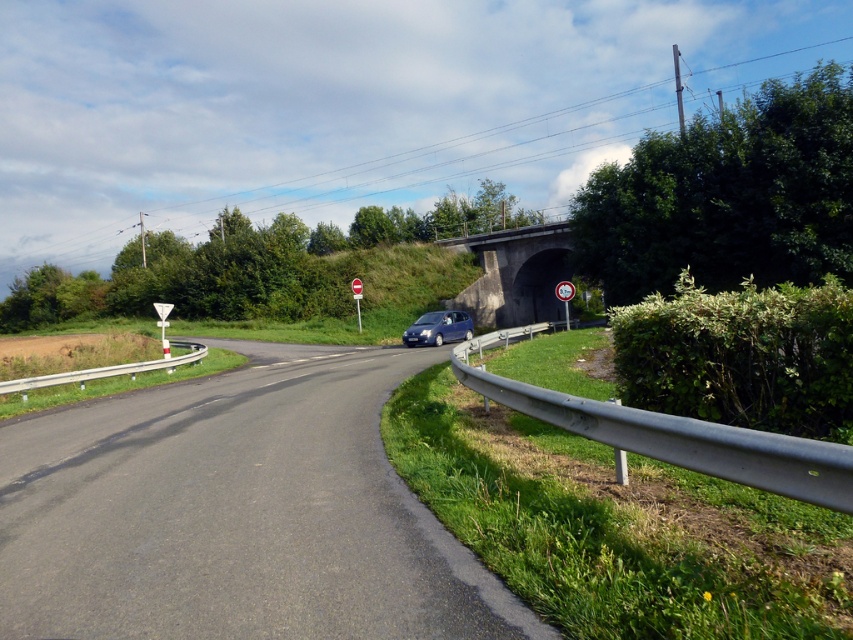
You are driving a car and see the asphalt road at center and the red plastic sign at center. Which object is closer to the bottom of the image?

The asphalt road at center is located below the red plastic sign at center, so the asphalt road at center is closer to the bottom of the image.

You are a driver approaching the road with a vehicle that has a height limit of 2 meters. You see the satin blue car at center and the white plastic sign at center. Which object is shorter and can safely pass under the bridge?

The satin blue car at center is not as tall as the white plastic sign at center, so the satin blue car at center is shorter and can safely pass under the bridge.

You are a GPS system trying to locate the asphalt road at center. What are the coordinates where you can find it?

The asphalt road at center can be found at coordinates point (236, 513).